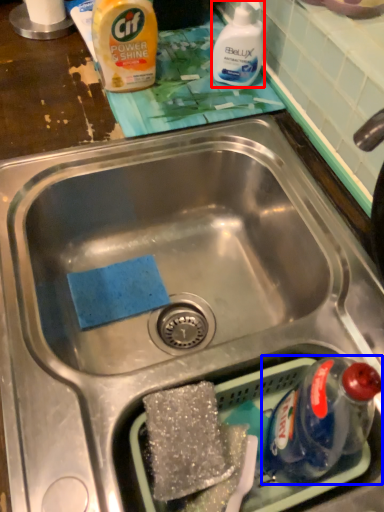
Question: Which object appears closest to the camera in this image, cleaning product (highlighted by a red box) or bottle (highlighted by a blue box)?

Choices:
 (A) cleaning product
 (B) bottle

Answer: (B)